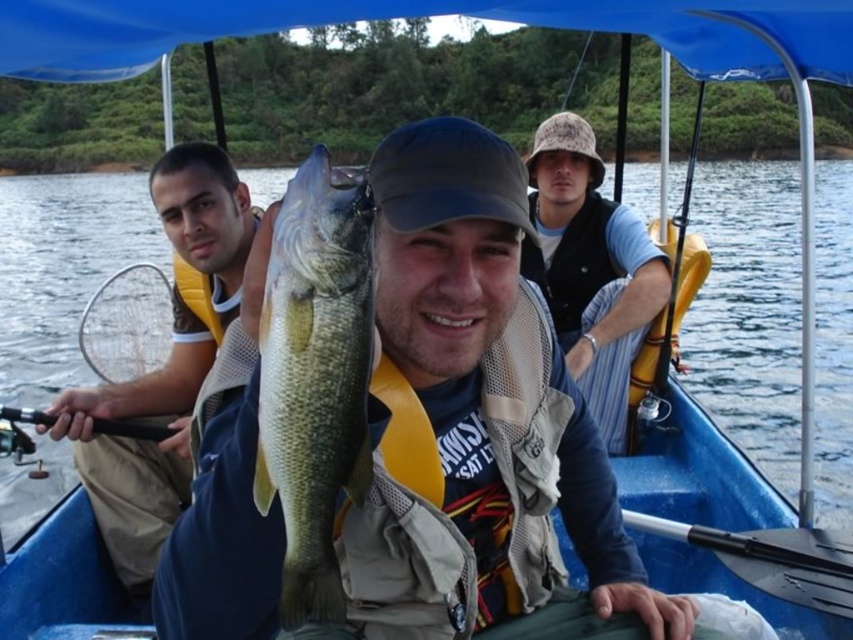
You are a photographer on the boat and want to take a photo of the green scaly fish at center and the yellow life vest at left. Which object should you focus on first if you want to capture both in the same frame without moving the camera?

The green scaly fish at center is in front of the yellow life vest at left, so you should focus on the green scaly fish at center first to ensure it is sharp while the yellow life vest at left will be in the background.

You are standing on the dock and looking at the green scaly fish at center. If your fishing rod can reach 3 feet, can you catch it?

The green scaly fish at center is 37.32 inches away from the viewer. Since 3 feet equals 36 inches, the fishing rod cannot reach the fish because it is 1.32 inches too far.